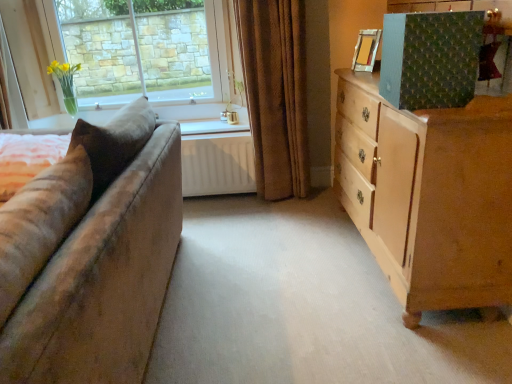
Question: Is light brown wooden chest of drawers at right inside the boundaries of brown velvet curtain at center, or outside?

Choices:
 (A) outside
 (B) inside

Answer: (A)

Question: Considering the positions of light brown wooden chest of drawers at right and brown velvet curtain at center in the image, is light brown wooden chest of drawers at right wider or thinner than brown velvet curtain at center?

Choices:
 (A) thin
 (B) wide

Answer: (B)

Question: Based on their relative distances, which object is farther from the light brown wooden chest of drawers at right?

Choices:
 (A) clear glass vase at upper left
 (B) brown velvet curtain at center
 (C) wooden picture frame at upper right
 (D) white matte radiator at center

Answer: (A)

Question: Estimate the real-world distances between objects in this image. Which object is farther from the light brown wooden chest of drawers at right?

Choices:
 (A) brown velvet curtain at center
 (B) wooden picture frame at upper right
 (C) clear glass vase at upper left
 (D) white matte radiator at center

Answer: (C)